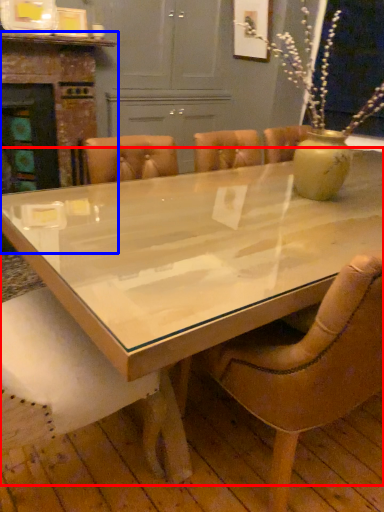
Question: Among these objects, which one is nearest to the camera, coffee table (highlighted by a red box) or fireplace (highlighted by a blue box)?

Choices:
 (A) coffee table
 (B) fireplace

Answer: (A)